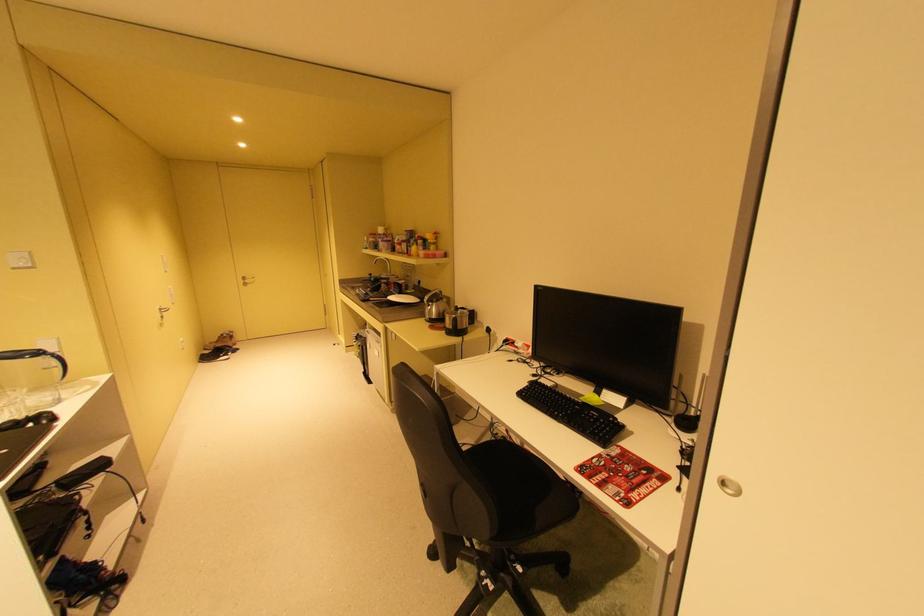
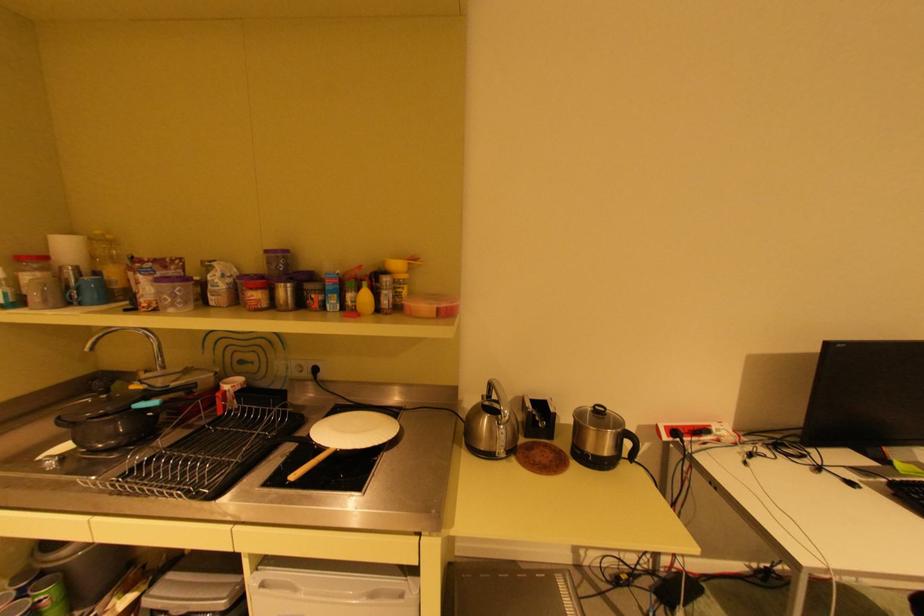
Where in the second image is the point corresponding to point 414,232 from the first image?

(274, 251)